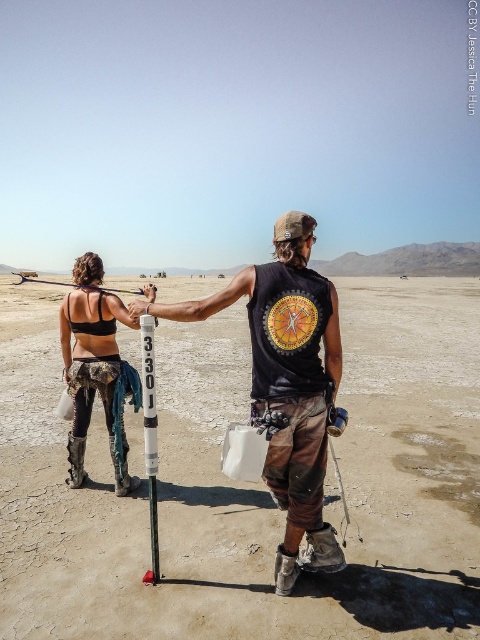
Question: Is black matte vest at center positioned before matte black tank top at left?

Choices:
 (A) no
 (B) yes

Answer: (B)

Question: Considering the real-world distances, which object is farthest from the black matte vest at center?

Choices:
 (A) dull brown dirt at center
 (B) matte black tank top at left

Answer: (A)

Question: Can you confirm if dull brown dirt at center is positioned below matte black tank top at left?

Choices:
 (A) no
 (B) yes

Answer: (A)

Question: Which object is closer to the camera taking this photo?

Choices:
 (A) dull brown dirt at center
 (B) matte black tank top at left
 (C) black matte vest at center

Answer: (C)

Question: Which is nearer to the matte black tank top at left?

Choices:
 (A) dull brown dirt at center
 (B) black matte vest at center

Answer: (B)

Question: Is dull brown dirt at center thinner than black matte vest at center?

Choices:
 (A) no
 (B) yes

Answer: (A)